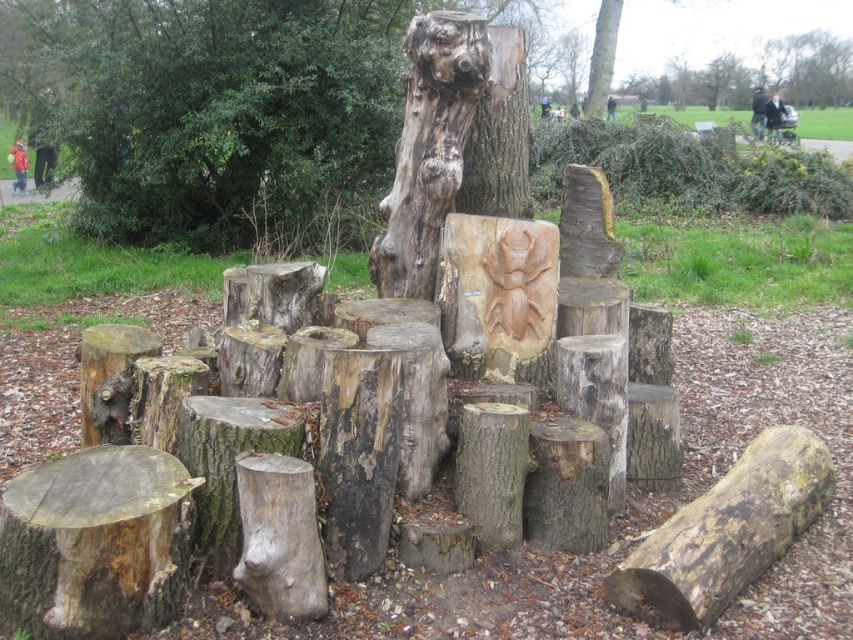
Does smooth wooden bench at upper center have a lesser width compared to brown rough tree trunk at upper center?

No.

Which is in front, point (750, 81) or point (611, 77)?

Point (611, 77)

You are a GUI agent. You are given a task and a screenshot of the screen. Output one action in this format:
    pyautogui.click(x=<x>, y=<y>)
    Task: Click on the smooth wooden bench at upper center
    The height and width of the screenshot is (640, 853).
    Given the screenshot: What is the action you would take?
    pyautogui.click(x=759, y=74)

Can you confirm if natural wood tree stump at center is positioned above brown rough tree trunk at upper center?

Actually, natural wood tree stump at center is below brown rough tree trunk at upper center.

Is point (80, 72) positioned behind point (595, 90)?

No.

Locate an element on the screen. natural wood tree stump at center is located at coordinates (219, 112).

Is natural wood tree stump at center shorter than smooth wooden bench at upper center?

Incorrect, natural wood tree stump at center's height does not fall short of smooth wooden bench at upper center's.

Which is behind, point (149, 36) or point (682, 88)?

The point (682, 88) is behind.

What do you see at coordinates (219, 112) in the screenshot? Image resolution: width=853 pixels, height=640 pixels. I see `natural wood tree stump at center` at bounding box center [219, 112].

Where is `natural wood tree stump at center`? natural wood tree stump at center is located at coordinates (219, 112).